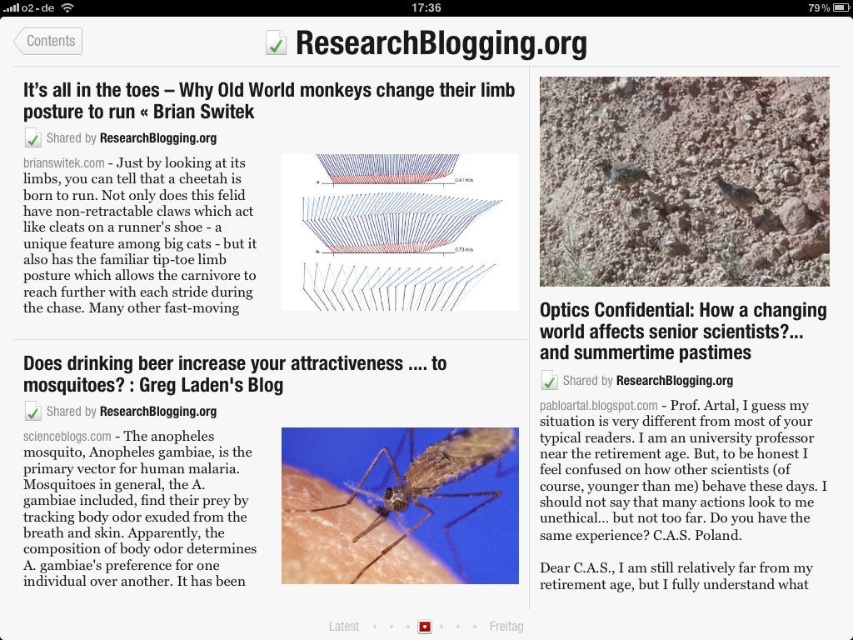
Question: Which point is farther to the camera?

Choices:
 (A) tap(612, 180)
 (B) tap(749, 200)
 (C) tap(381, 428)

Answer: (A)

Question: Which object is farther from the camera taking this photo?

Choices:
 (A) translucent brown mosquito at center
 (B) brown fuzzy mosquito at center

Answer: (B)

Question: Does translucent brown mosquito at center appear on the right side of matte brown mosquito at center?

Choices:
 (A) no
 (B) yes

Answer: (A)

Question: Can you confirm if brown fuzzy mosquito at center is positioned below matte brown mosquito at center?

Choices:
 (A) no
 (B) yes

Answer: (A)

Question: Can you confirm if translucent brown mosquito at center is bigger than brown fuzzy mosquito at center?

Choices:
 (A) yes
 (B) no

Answer: (A)

Question: Which object appears closest to the camera in this image?

Choices:
 (A) matte brown mosquito at center
 (B) translucent brown mosquito at center

Answer: (B)